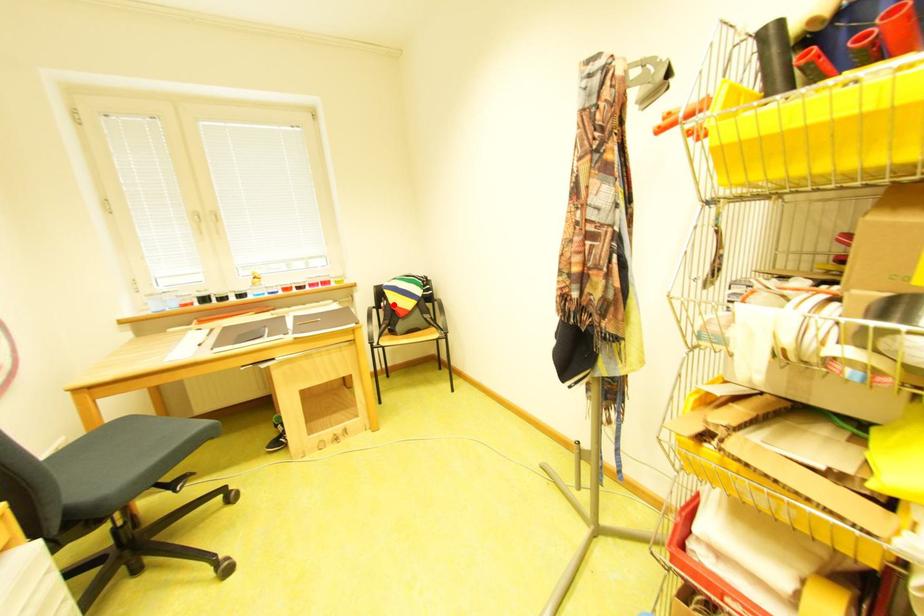
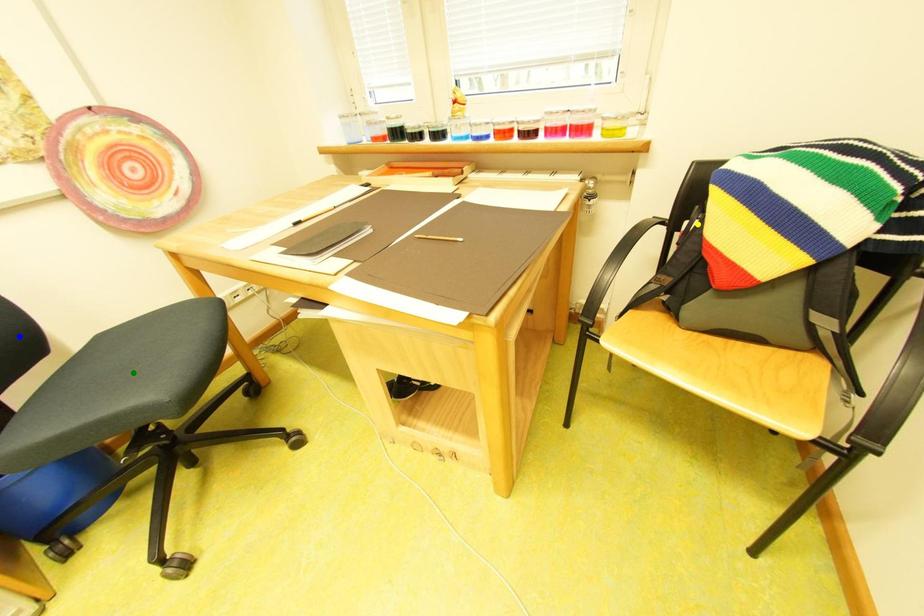
Question: I am providing you with two images of the same scene from different viewpoints. A red point is marked on the first image. You are given multiple points on the second image. Which point in image 2 is actually the same real-world point as the red point in image 1?

Choices:
 (A) yellow point
 (B) green point
 (C) blue point

Answer: (A)